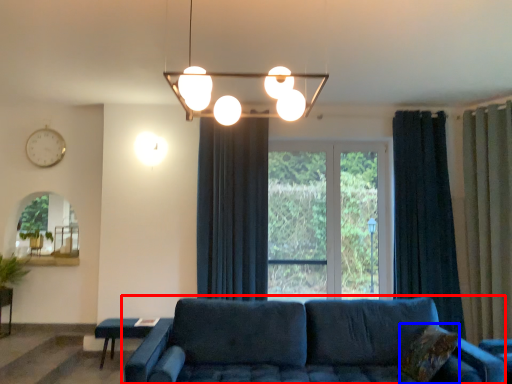
Question: Which of the following is the closest to the observer, studio couch (highlighted by a red box) or pillow (highlighted by a blue box)?

Choices:
 (A) studio couch
 (B) pillow

Answer: (A)